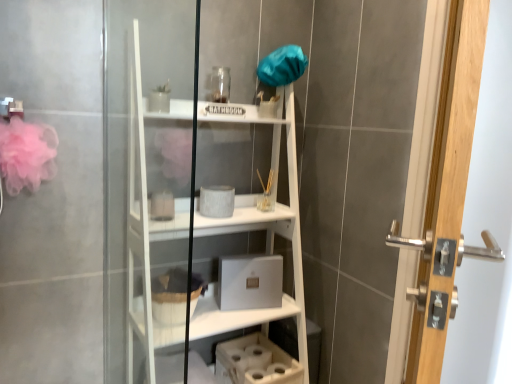
This screenshot has width=512, height=384. Describe the element at coordinates (257, 229) in the screenshot. I see `white matte bookshelf at center` at that location.

Describe the element at coordinates (437, 186) in the screenshot. This screenshot has height=384, width=512. I see `polished silver handle at right` at that location.

Where is `fuzzy fabric basket at lower center`? fuzzy fabric basket at lower center is located at coordinates (170, 297).

From the image's perspective, is fuzzy fabric basket at lower center positioned above or below polished silver handle at right?

fuzzy fabric basket at lower center is situated lower than polished silver handle at right in the image.

Locate an element on the screen. The height and width of the screenshot is (384, 512). door that appears above the fuzzy fabric basket at lower center (from the image's perspective) is located at coordinates (437, 186).

From the picture: Is fuzzy fabric basket at lower center wider than polished silver handle at right?

Yes, fuzzy fabric basket at lower center is wider than polished silver handle at right.

Can you tell me how much white matte bookshelf at center and fuzzy fabric basket at lower center differ in facing direction?

They differ by 0.284 degrees in their facing directions.

Does point (284, 92) appear closer or farther from the camera than point (181, 304)?

Point (284, 92).

Which object is wider, white matte bookshelf at center or fuzzy fabric basket at lower center?

Wider between the two is white matte bookshelf at center.

Is white matte bookshelf at center inside the boundaries of fuzzy fabric basket at lower center, or outside?

white matte bookshelf at center exists outside the volume of fuzzy fabric basket at lower center.

From a real-world perspective, which object rests below the other?

white matte bookshelf at center.

Does point (428, 289) come in front of point (274, 311)?

That is True.

Considering the relative positions of polished silver handle at right and white matte bookshelf at center in the image provided, is polished silver handle at right behind white matte bookshelf at center?

No, polished silver handle at right is closer to the camera.

Is polished silver handle at right taller than white matte bookshelf at center?

No.

Is fuzzy fabric basket at lower center to the right of white matte bookshelf at center from the viewer's perspective?

No.

Is there a large distance between fuzzy fabric basket at lower center and white matte bookshelf at center?

Actually, fuzzy fabric basket at lower center and white matte bookshelf at center are a little close together.

Which is closer, (167, 290) or (240, 322)?

Point (167, 290).

From the image's perspective, which is above, white matte bookshelf at center or polished silver handle at right?

polished silver handle at right is shown above in the image.

Considering the relative sizes of white matte bookshelf at center and polished silver handle at right in the image provided, is white matte bookshelf at center wider than polished silver handle at right?

Yes.

From a real-world perspective, which is physically below, white matte bookshelf at center or polished silver handle at right?

white matte bookshelf at center.

From a real-world perspective, is polished silver handle at right located beneath fuzzy fabric basket at lower center?

No, from a real-world perspective, polished silver handle at right is not below fuzzy fabric basket at lower center.

Between point (430, 287) and point (180, 270), which one is positioned in front?

The point (430, 287) is closer.

Locate an element on the screen. Image resolution: width=512 pixels, height=384 pixels. door on the right of fuzzy fabric basket at lower center is located at coordinates (437, 186).

Is polished silver handle at right taller than fuzzy fabric basket at lower center?

Indeed, polished silver handle at right has a greater height compared to fuzzy fabric basket at lower center.

Find the location of a particular element. door above the fuzzy fabric basket at lower center (from the image's perspective) is located at coordinates (437, 186).

Locate an element on the screen. basket directly beneath the white matte bookshelf at center (from a real-world perspective) is located at coordinates (170, 297).

Looking at the image, which one is located closer to fuzzy fabric basket at lower center, polished silver handle at right or white matte bookshelf at center?

white matte bookshelf at center.

Estimate the real-world distances between objects in this image. Which object is further from white matte bookshelf at center, fuzzy fabric basket at lower center or polished silver handle at right?

Among the two, polished silver handle at right is located further to white matte bookshelf at center.

Estimate the real-world distances between objects in this image. Which object is closer to polished silver handle at right, fuzzy fabric basket at lower center or white matte bookshelf at center?

white matte bookshelf at center.

When comparing their distances from polished silver handle at right, does white matte bookshelf at center or fuzzy fabric basket at lower center seem further?

Based on the image, fuzzy fabric basket at lower center appears to be further to polished silver handle at right.

Estimate the real-world distances between objects in this image. Which object is closer to fuzzy fabric basket at lower center, white matte bookshelf at center or polished silver handle at right?

white matte bookshelf at center is positioned closer to the anchor fuzzy fabric basket at lower center.

Looking at the image, which one is located closer to white matte bookshelf at center, polished silver handle at right or fuzzy fabric basket at lower center?

The object closer to white matte bookshelf at center is fuzzy fabric basket at lower center.

Where is `bookshelf between polished silver handle at right and fuzzy fabric basket at lower center from front to back`? This screenshot has width=512, height=384. bookshelf between polished silver handle at right and fuzzy fabric basket at lower center from front to back is located at coordinates (257, 229).